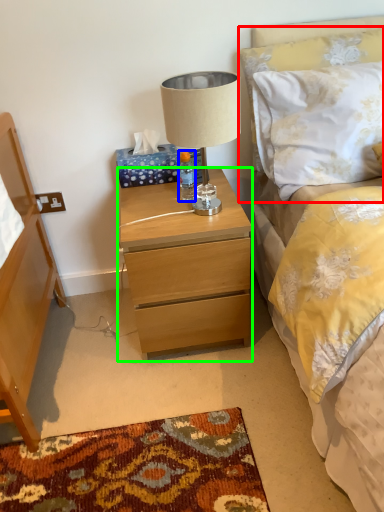
Question: Which is farther away from pillow (highlighted by a red box)? bottle (highlighted by a blue box) or nightstand (highlighted by a green box)?

Choices:
 (A) bottle
 (B) nightstand

Answer: (B)